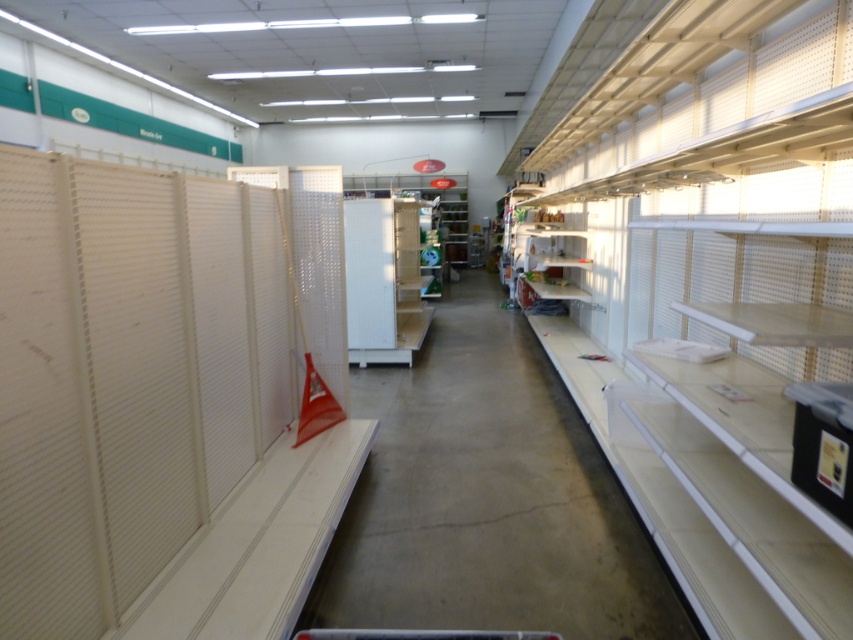
You are a store employee who needs to place a new item on the white plastic shelves at center and the white matte shelf at center. Which shelf should you approach first if you are standing at the left end of the aisle?

You should approach the white matte shelf at center first because it is to the left of the white plastic shelves at center, so it is closer to your current position at the left end of the aisle.

You are a store employee who needs to place a new item on the white plastic shelves at center and the white matte shelf at center. Which shelf should you place the item on if you want it to be more visible to customers walking through the aisle?

The white matte shelf at center is located above the white plastic shelves at center, so placing the item on the white matte shelf at center would make it more visible to customers.

You are standing in the retail store aisle and want to determine which of the two points, point (x=450, y=572) or point (x=383, y=337), is closer to you. Based on the scene description, which point is nearer?

Point (x=450, y=572) is closer to the camera than point (x=383, y=337), so it is nearer to you.